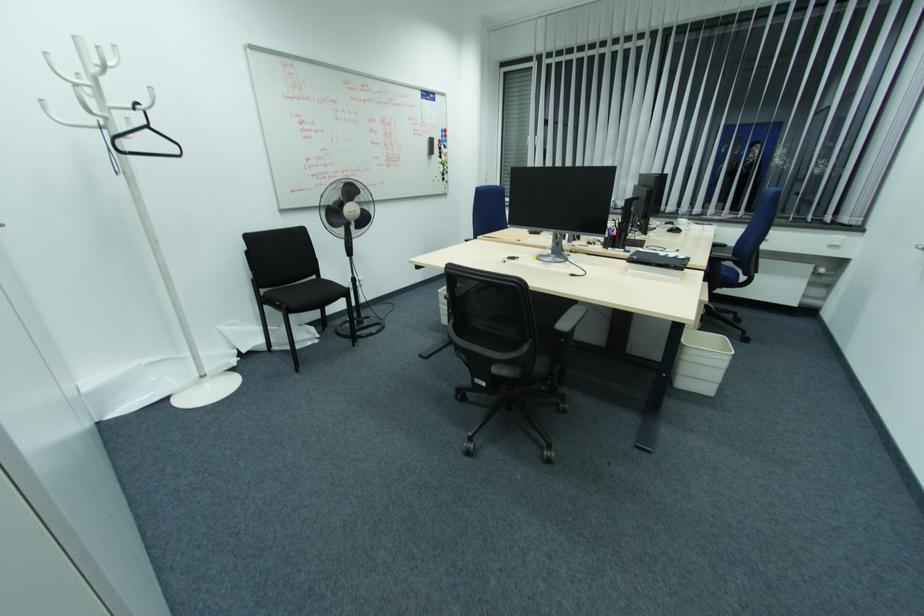
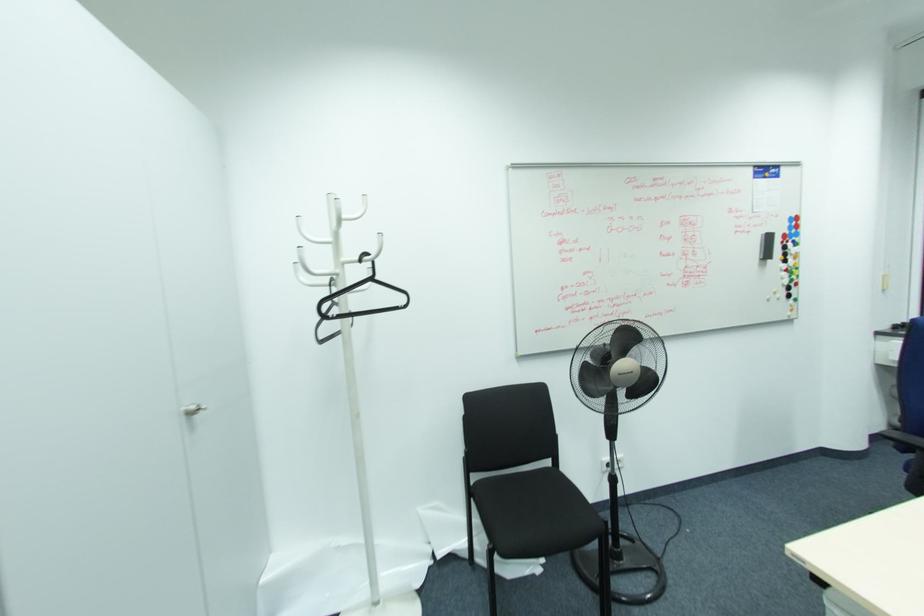
Where in the second image is the point corresponding to the point at 149,128 from the first image?

(371, 280)